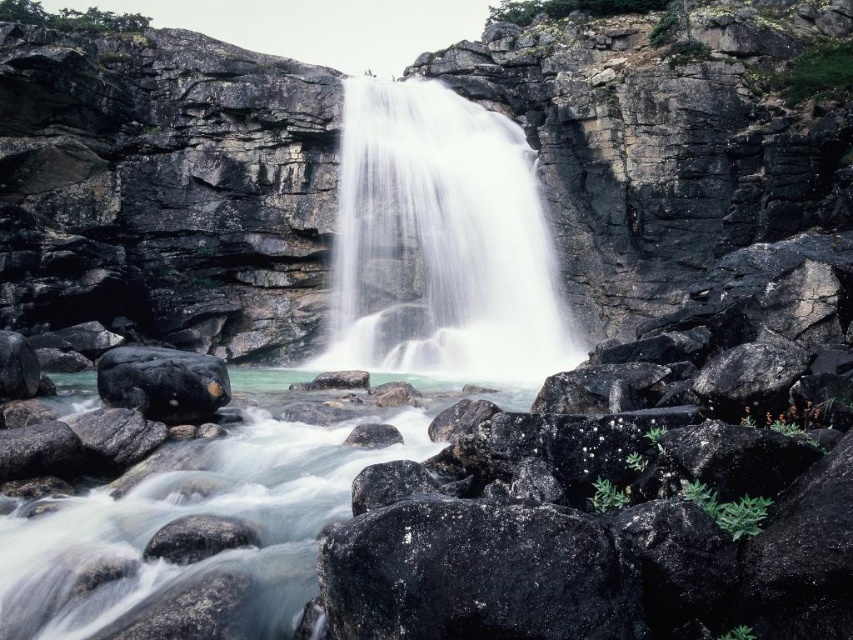
Question: Is white smooth waterfall at center above glossy black rock at center?

Choices:
 (A) no
 (B) yes

Answer: (B)

Question: Does white smooth waterfall at center have a larger size compared to clear water at center?

Choices:
 (A) yes
 (B) no

Answer: (A)

Question: Which point is closer to the camera taking this photo?

Choices:
 (A) (543, 616)
 (B) (422, 355)
 (C) (161, 497)
 (D) (97, 371)

Answer: (A)

Question: Which point appears farthest from the camera in this image?

Choices:
 (A) (421, 435)
 (B) (380, 582)

Answer: (A)

Question: Based on their relative distances, which object is nearer to the black smooth rock at lower left?

Choices:
 (A) white smooth waterfall at center
 (B) clear water at center

Answer: (B)

Question: Can you confirm if clear water at center is positioned to the left of black smooth rock at lower left?

Choices:
 (A) yes
 (B) no

Answer: (B)